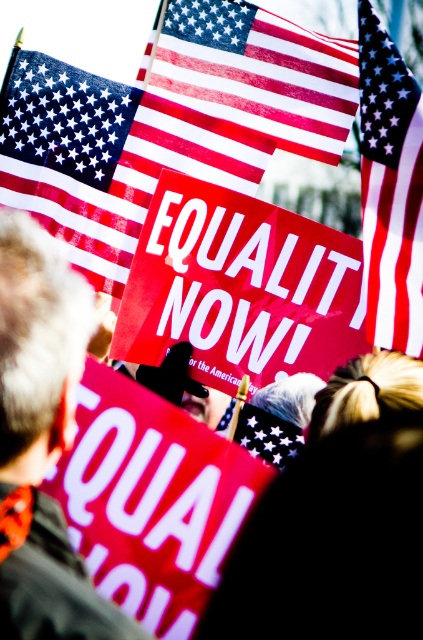
The width and height of the screenshot is (423, 640). What are the coordinates of `matte red flag at upper center` in the screenshot? It's located at (107, 157).

Is matte red flag at upper center wider than gray hair at upper left?

Yes, matte red flag at upper center is wider than gray hair at upper left.

Is point (27, 148) more distant than point (76, 589)?

Yes.

Image resolution: width=423 pixels, height=640 pixels. What are the coordinates of `matte red flag at upper center` in the screenshot? It's located at (107, 157).

I want to click on gray hair at upper left, so click(41, 440).

Is gray hair at upper left smaller than matte fabric flag at upper right?

No.

Is point (0, 410) more distant than point (368, 256)?

That is False.

At what (x,y) coordinates should I click in order to perform the action: click on gray hair at upper left. Please return your answer as a coordinate pair (x, y). Looking at the image, I should click on (41, 440).

Which is above, matte red flag at upper center or matte fabric flag at upper right?

matte red flag at upper center is above.

Is point (164, 99) farther from camera compared to point (370, 268)?

Yes, it is.

Measure the distance between matte red flag at upper center and camera.

A distance of 12.46 meters exists between matte red flag at upper center and camera.

At what (x,y) coordinates should I click in order to perform the action: click on matte red flag at upper center. Please return your answer as a coordinate pair (x, y). The image size is (423, 640). Looking at the image, I should click on (107, 157).